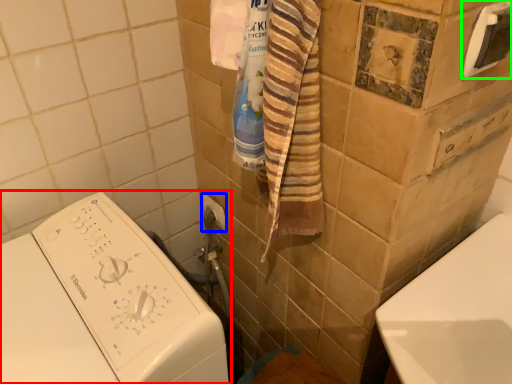
Question: Which object is the farthest from washing machine (highlighted by a red box)? Choose among these: towel bar (highlighted by a blue box) or towel bar (highlighted by a green box).

Choices:
 (A) towel bar
 (B) towel bar

Answer: (B)